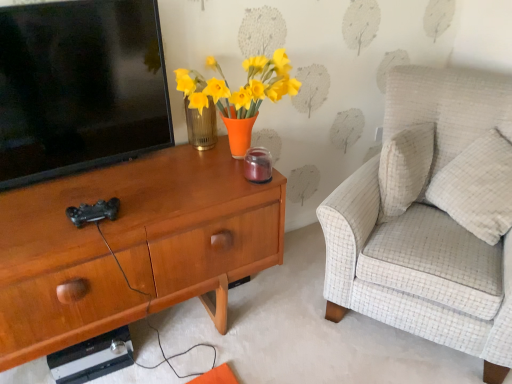
Locate an element on the screen. free location in front of black glossy television at left is located at coordinates (74, 198).